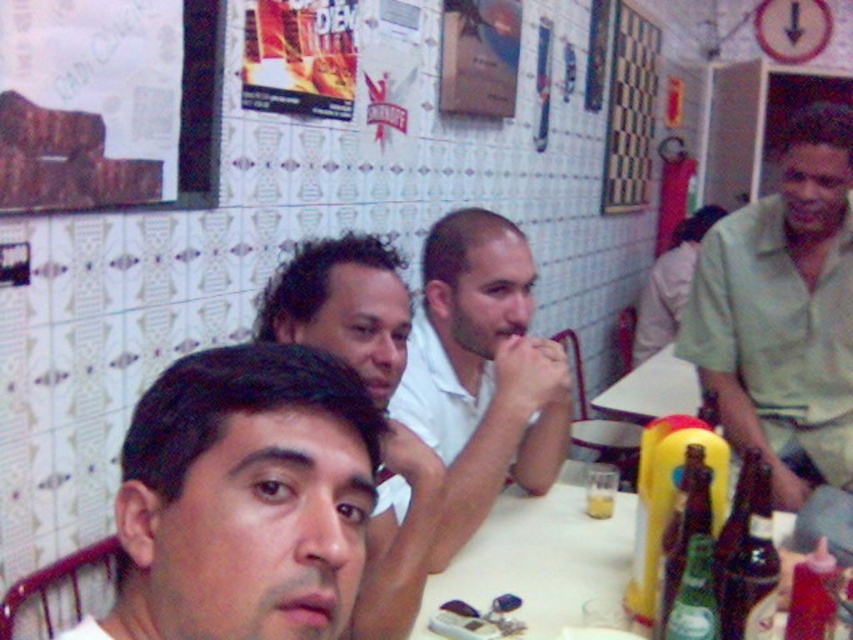
Question: Among these points, which one is nearest to the camera?

Choices:
 (A) (780, 442)
 (B) (430, 381)

Answer: (B)

Question: Which of the following is the farthest from the observer?

Choices:
 (A) white matte shirt at center
 (B) checkerboard pattern at upper right
 (C) white plastic table at center
 (D) green cotton shirt at right

Answer: (B)

Question: Which object is positioned farthest from the green glass bottles at lower center?

Choices:
 (A) smooth skin face at center
 (B) dark curly hair at center
 (C) white plastic table at center
 (D) brown glass bottle at right

Answer: (C)

Question: Is green cotton shirt at right smaller than dark curly hair at center?

Choices:
 (A) yes
 (B) no

Answer: (B)

Question: Does dark curly hair at center appear over green glass bottles at lower center?

Choices:
 (A) no
 (B) yes

Answer: (B)

Question: Does green glass bottles at lower center have a larger size compared to checkerboard pattern at upper right?

Choices:
 (A) yes
 (B) no

Answer: (B)